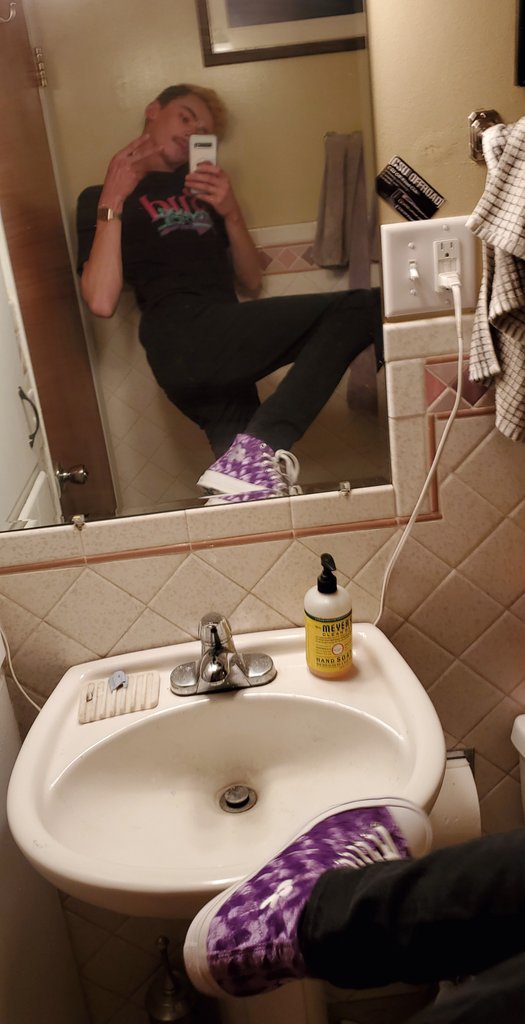
You are a GUI agent. You are given a task and a screenshot of the screen. Output one action in this format:
    pyautogui.click(x=<x>, y=<y>)
    Task: Click on the soap
    
    Given the screenshot: What is the action you would take?
    pyautogui.click(x=334, y=644)